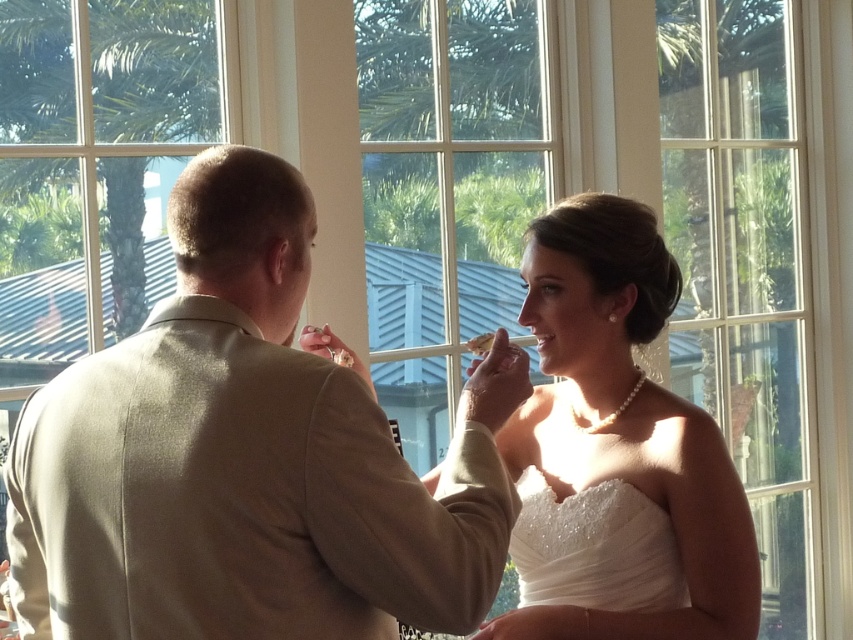
In the scene shown: You are a photographer at the wedding and need to adjust the lighting to ensure both the tan fabric suit at center and the pearl necklace at upper center are well lit. Considering their sizes, which object requires a wider light beam to cover its entire surface?

The tan fabric suit at center requires a wider light beam because its width surpasses that of the pearl necklace at upper center.

Based on the photo, based on the scene description, which object is positioned higher in the image between the pearl necklace at upper center and the white beaded fabric at center?

The pearl necklace at upper center is positioned higher than the white beaded fabric at center.

You are a photographer at the wedding, and you want to capture a closeup shot of the pearl necklace at upper center without the white beaded fabric at center blocking the view. Can you adjust your camera angle to achieve this?

Yes, since the pearl necklace at upper center is closer to the viewer than the white beaded fabric at center, adjusting the camera angle slightly towards the necklace should allow you to capture it without obstruction from the fabric.